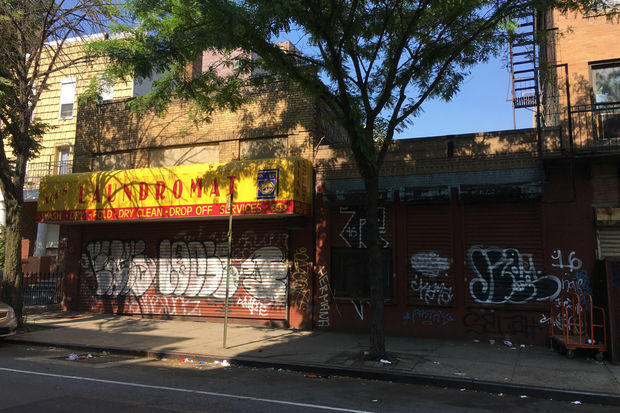
This screenshot has width=620, height=413. Find the location of `laundromat`. laundromat is located at coordinates (157, 188).